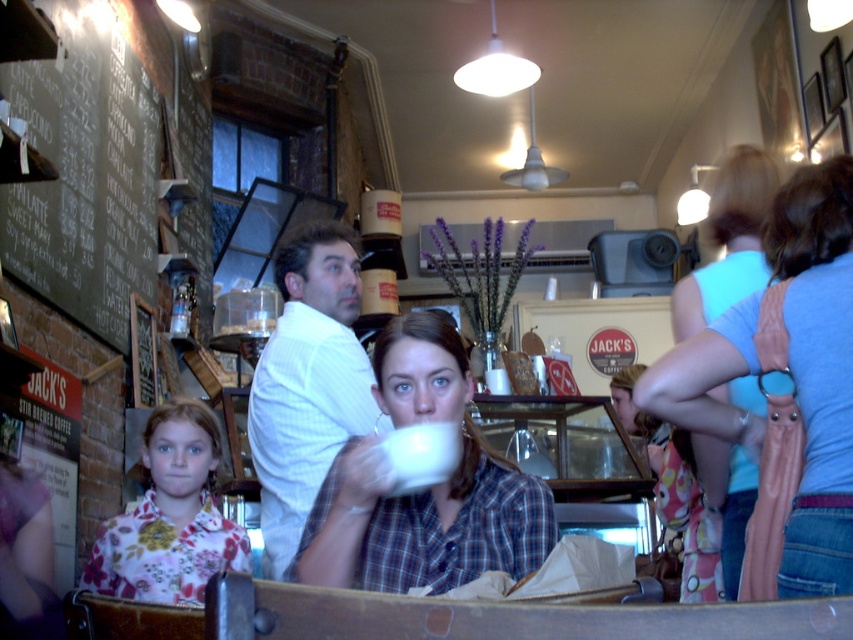
Question: Based on their relative distances, which object is farther from the white checkered shirt at center?

Choices:
 (A) matte white cup at center
 (B) floral fabric shirt at lower left
 (C) light blue fabric purse at right

Answer: (C)

Question: Which object is farther from the camera taking this photo?

Choices:
 (A) matte white cup at center
 (B) white checkered shirt at center
 (C) floral fabric shirt at lower left
 (D) light blue fabric purse at right

Answer: (C)

Question: Is white checkered shirt at center to the left of floral fabric shirt at lower left from the viewer's perspective?

Choices:
 (A) yes
 (B) no

Answer: (B)

Question: Which point is closer to the camera taking this photo?

Choices:
 (A) (316, 467)
 (B) (206, 538)

Answer: (A)

Question: Is the position of matte white cup at center less distant than that of floral fabric shirt at lower left?

Choices:
 (A) no
 (B) yes

Answer: (B)

Question: Does light blue fabric purse at right come in front of white checkered shirt at center?

Choices:
 (A) no
 (B) yes

Answer: (B)